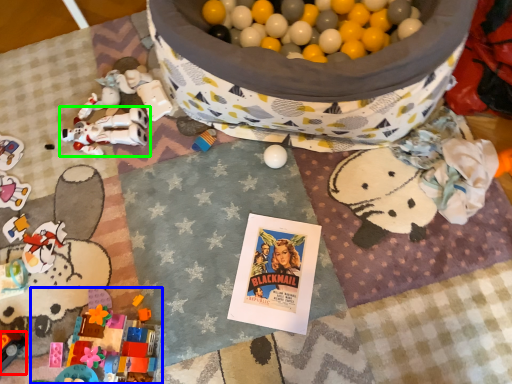
Question: Which is farther away from toy (highlighted by a red box)? toy (highlighted by a blue box) or toy (highlighted by a green box)?

Choices:
 (A) toy
 (B) toy

Answer: (B)